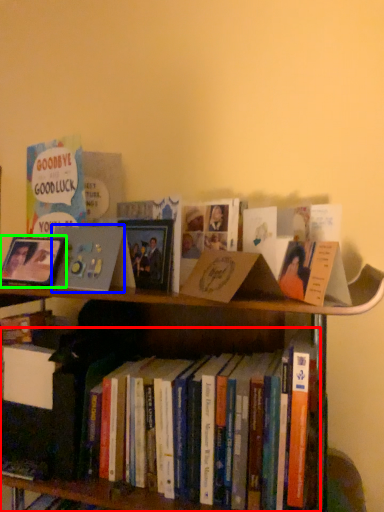
Question: Which is farther away from book (highlighted by a red box)? book cover (highlighted by a blue box) or picture frame (highlighted by a green box)?

Choices:
 (A) book cover
 (B) picture frame

Answer: (B)